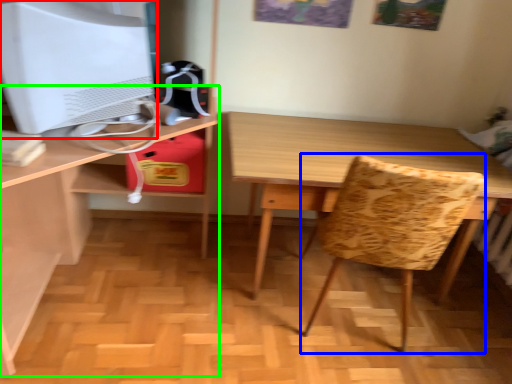
Question: Based on their relative distances, which object is nearer to computer monitor (highlighted by a red box)? Choose from swivel chair (highlighted by a blue box) and desk (highlighted by a green box).

Choices:
 (A) swivel chair
 (B) desk

Answer: (B)